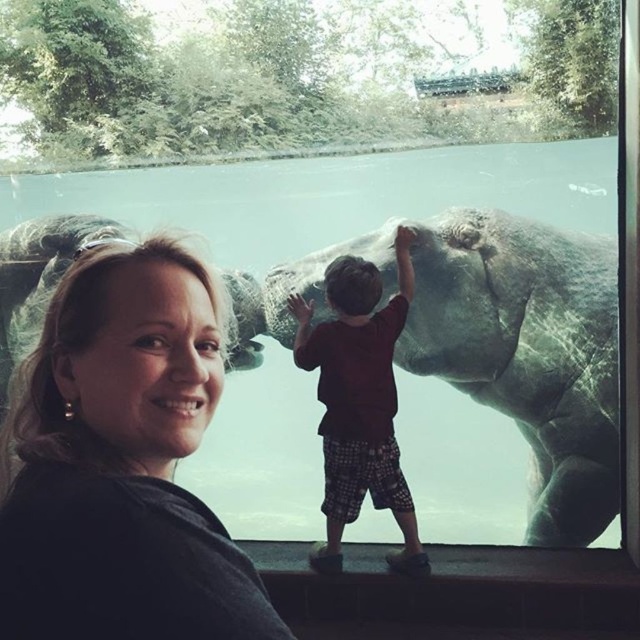
Question: Which point is closer to the camera taking this photo?

Choices:
 (A) (435, 268)
 (B) (173, 561)
 (C) (401, 268)

Answer: (B)

Question: Which point appears farthest from the camera in this image?

Choices:
 (A) (464, 256)
 (B) (180, 372)

Answer: (A)

Question: From the image, what is the correct spatial relationship of matte black hair at upper left in relation to gray matte elephant at center?

Choices:
 (A) right
 (B) left

Answer: (B)

Question: Can you confirm if gray matte elephant at center is smaller than brown cotton shirt at center?

Choices:
 (A) no
 (B) yes

Answer: (A)

Question: Estimate the real-world distances between objects in this image. Which object is closer to the matte black hair at upper left?

Choices:
 (A) brown cotton shirt at center
 (B) gray matte elephant at center

Answer: (A)

Question: Does gray matte elephant at center appear under brown cotton shirt at center?

Choices:
 (A) no
 (B) yes

Answer: (A)